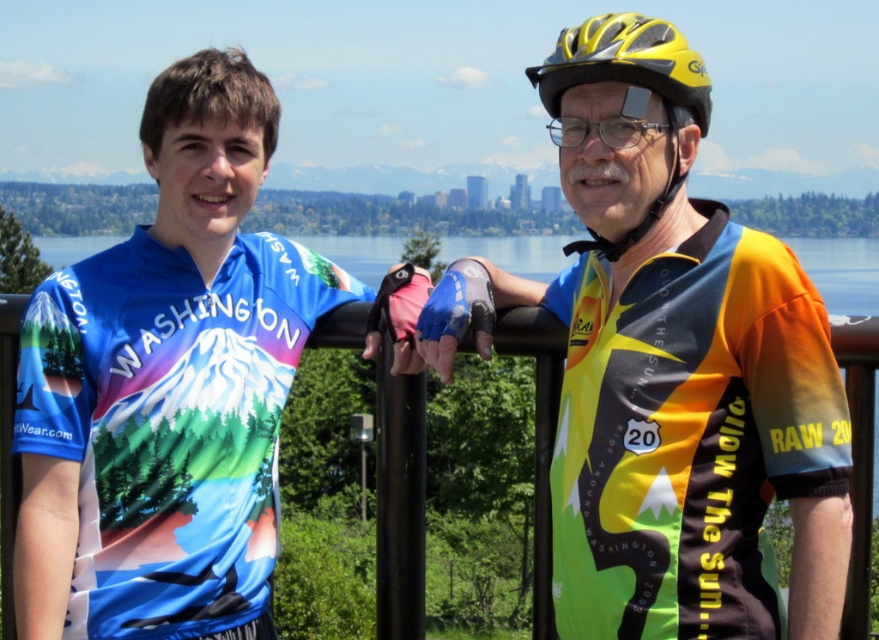
Question: Among these objects, which one is nearest to the camera?

Choices:
 (A) transparent plastic goggles at upper center
 (B) yellow matte bicycle helmet at upper center

Answer: (B)

Question: Which object is the closest to the blue jersey at left?

Choices:
 (A) yellow matte bicycle helmet at upper center
 (B) neon yellow jersey at center

Answer: (B)

Question: Does blue jersey at left have a lesser width compared to yellow matte bicycle helmet at upper center?

Choices:
 (A) no
 (B) yes

Answer: (A)

Question: Observing the image, what is the correct spatial positioning of neon yellow jersey at center in reference to blue jersey at left?

Choices:
 (A) left
 (B) right

Answer: (B)

Question: Based on their relative distances, which object is farther from the neon yellow jersey at center?

Choices:
 (A) yellow matte bicycle helmet at upper center
 (B) blue jersey at left

Answer: (B)

Question: Does neon yellow jersey at center have a lesser width compared to transparent plastic goggles at upper center?

Choices:
 (A) yes
 (B) no

Answer: (B)